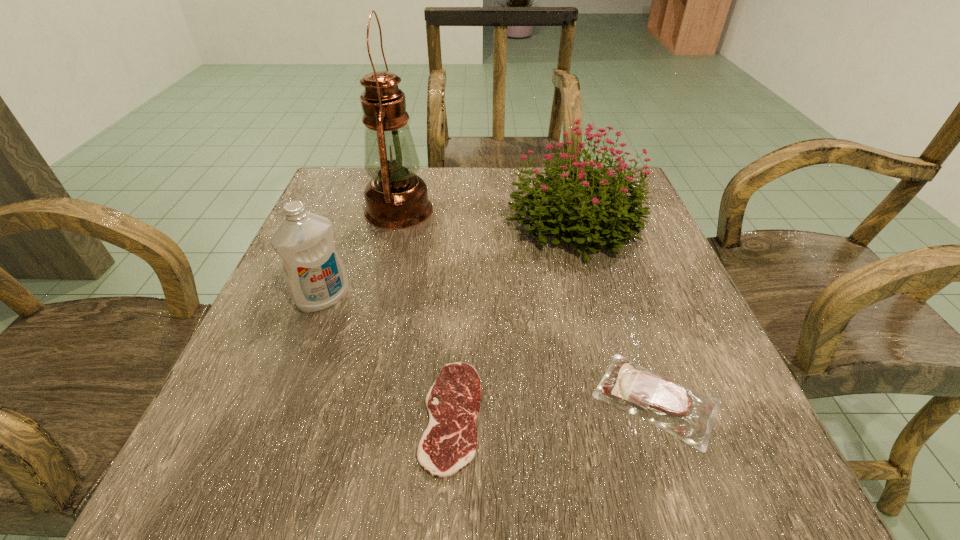
Locate an element on the screen. The height and width of the screenshot is (540, 960). vacant area that lies between the tallest object and the third nearest object is located at coordinates (361, 254).

Image resolution: width=960 pixels, height=540 pixels. What are the coordinates of `free space between the bouquet and the taller steak` in the screenshot? It's located at click(x=614, y=310).

The image size is (960, 540). In order to click on vacant space in between the detergent and the tallest object in this screenshot , I will do `click(361, 254)`.

In order to click on vacant space in between the third nearest object and the right steak in this screenshot , I will do `click(490, 349)`.

Where is `vacant region between the third farthest object and the third object from left to right`? vacant region between the third farthest object and the third object from left to right is located at coordinates (388, 357).

Image resolution: width=960 pixels, height=540 pixels. What are the coordinates of `free space between the bouquet and the third nearest object` in the screenshot? It's located at (448, 260).

Identify which object is located as the second nearest to the third object from right to left. Please provide its 2D coordinates. Your answer should be formatted as a tuple, i.e. [(x, y)], where the tuple contains the x and y coordinates of a point satisfying the conditions above.

[(315, 276)]

Identify the location of object that is the second nearest to the detergent. The height and width of the screenshot is (540, 960). (449, 443).

Locate an element on the screen. This screenshot has width=960, height=540. vacant space that satisfies the following two spatial constraints: 1. on the back side of the bouquet; 2. on the left side of the detergent is located at coordinates (352, 222).

This screenshot has width=960, height=540. Identify the location of vacant region that satisfies the following two spatial constraints: 1. on the front side of the right steak; 2. on the right side of the detergent. (286, 399).